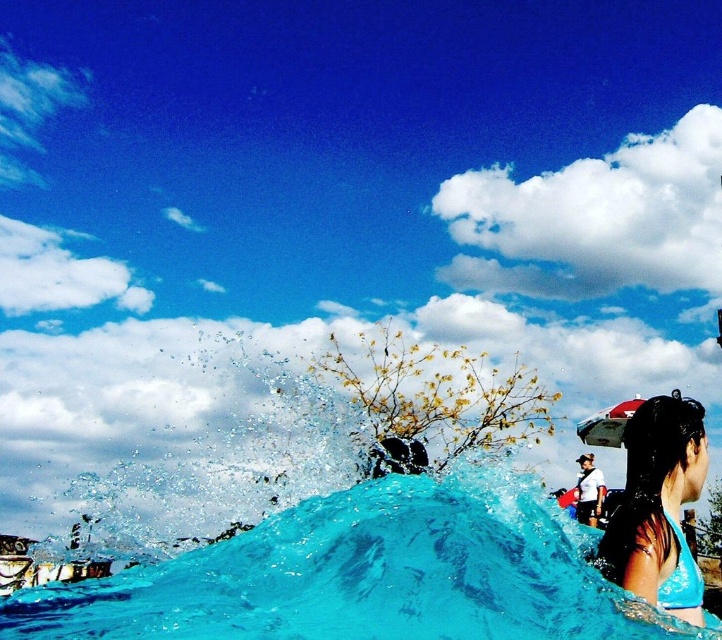
Question: Does translucent blue water at center lie behind blue fabric bikini top at lower right?

Choices:
 (A) yes
 (B) no

Answer: (B)

Question: Which is farther from the translucent blue water at center?

Choices:
 (A) clear water splash at center
 (B) blue fabric bikini top at lower right

Answer: (A)

Question: Which point is closer to the camera?

Choices:
 (A) translucent blue water at center
 (B) clear water splash at center

Answer: (A)

Question: Does clear water splash at center have a larger size compared to blue fabric bikini top at lower right?

Choices:
 (A) no
 (B) yes

Answer: (B)

Question: Is translucent blue water at center to the right of blue fabric bikini top at lower right from the viewer's perspective?

Choices:
 (A) no
 (B) yes

Answer: (A)

Question: Among these points, which one is farthest from the camera?

Choices:
 (A) (303, 484)
 (B) (434, 568)

Answer: (A)